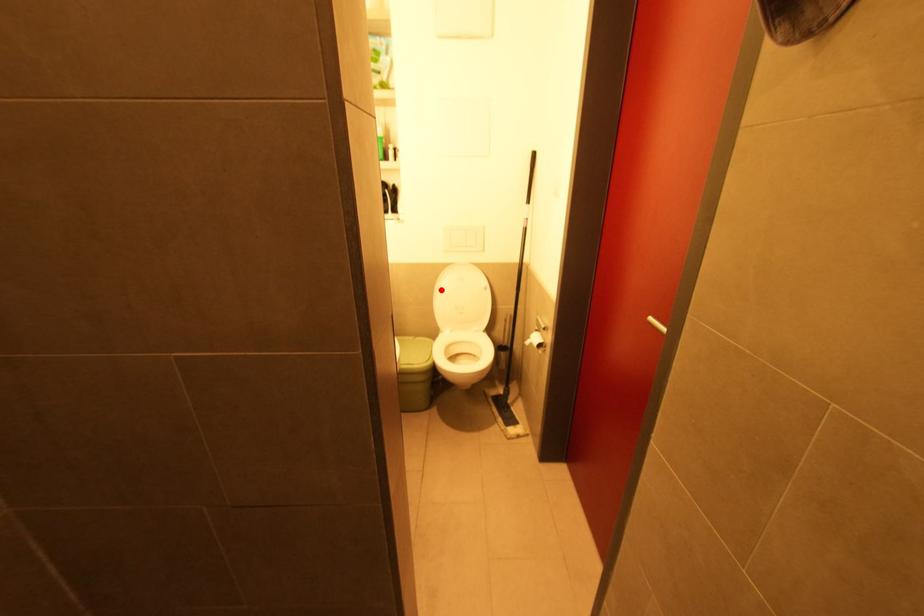
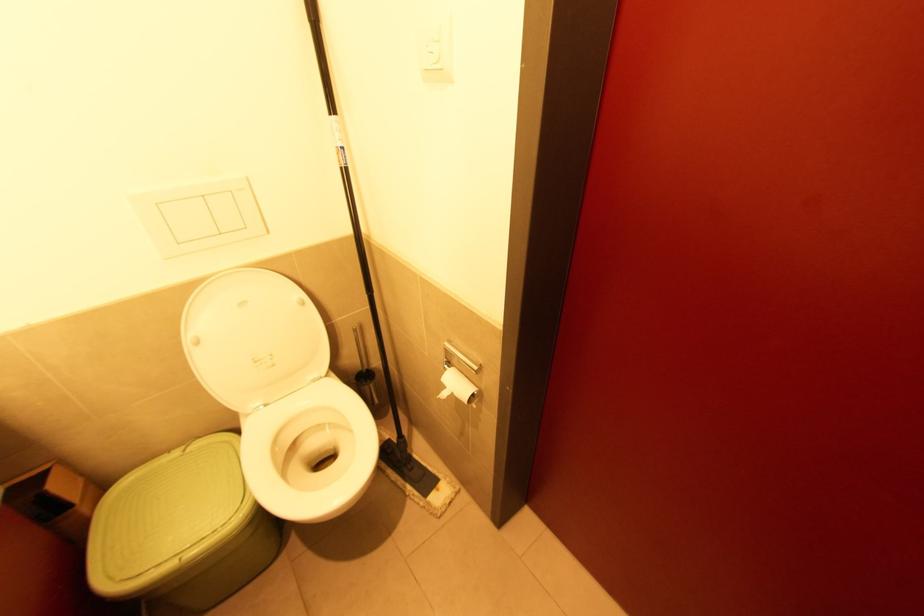
In the second image, find the point that corresponds to the highlighted location in the first image.

(200, 342)